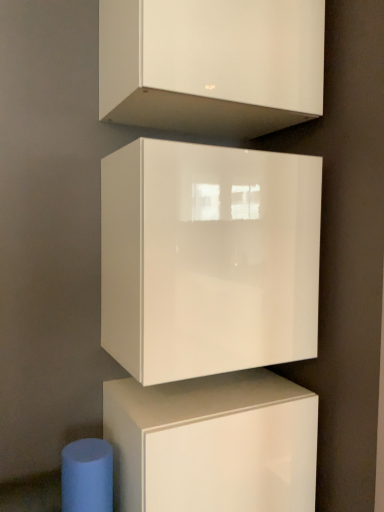
Question: In which direction should I rotate to look at glossy white cabinet at center, which appears as the 3th cabinetry when viewed from the top?

Choices:
 (A) right
 (B) left

Answer: (A)

Question: Is white glossy cabinet at upper center, which appears as the 3th cabinetry when ordered from the bottom, wider than glossy white cube at center, positioned as the 2th cabinetry in bottom-to-top order?

Choices:
 (A) yes
 (B) no

Answer: (B)

Question: Considering the relative positions of white glossy cabinet at upper center, the 1th cabinetry viewed from the top, and glossy white cube at center, positioned as the 2th cabinetry in bottom-to-top order, in the image provided, is white glossy cabinet at upper center, the 1th cabinetry viewed from the top, in front of glossy white cube at center, positioned as the 2th cabinetry in bottom-to-top order,?

Choices:
 (A) yes
 (B) no

Answer: (A)

Question: Can you confirm if white glossy cabinet at upper center, the 1th cabinetry viewed from the top, is thinner than glossy white cube at center, positioned as the 2th cabinetry in bottom-to-top order?

Choices:
 (A) yes
 (B) no

Answer: (A)

Question: Is white glossy cabinet at upper center, which appears as the 3th cabinetry when ordered from the bottom, to the left of glossy white cube at center, which is the second cabinetry in top-to-bottom order, from the viewer's perspective?

Choices:
 (A) yes
 (B) no

Answer: (B)

Question: From the image's perspective, is white glossy cabinet at upper center, which appears as the 3th cabinetry when ordered from the bottom, under glossy white cube at center, positioned as the 2th cabinetry in bottom-to-top order?

Choices:
 (A) no
 (B) yes

Answer: (A)

Question: Considering the relative sizes of white glossy cabinet at upper center, which appears as the 3th cabinetry when ordered from the bottom, and glossy white cube at center, which is the second cabinetry in top-to-bottom order, in the image provided, is white glossy cabinet at upper center, which appears as the 3th cabinetry when ordered from the bottom, taller than glossy white cube at center, which is the second cabinetry in top-to-bottom order,?

Choices:
 (A) yes
 (B) no

Answer: (B)

Question: Would you consider glossy white cabinet at center, which appears as the 3th cabinetry when viewed from the top, to be distant from glossy white cube at center, which is the second cabinetry in top-to-bottom order?

Choices:
 (A) yes
 (B) no

Answer: (B)

Question: Is glossy white cabinet at center, which appears as the 3th cabinetry when viewed from the top, to the right of glossy white cube at center, positioned as the 2th cabinetry in bottom-to-top order, from the viewer's perspective?

Choices:
 (A) yes
 (B) no

Answer: (B)

Question: From a real-world perspective, is glossy white cabinet at center, which appears as the 3th cabinetry when viewed from the top, under glossy white cube at center, which is the second cabinetry in top-to-bottom order?

Choices:
 (A) yes
 (B) no

Answer: (A)

Question: Does glossy white cabinet at center, acting as the 1th cabinetry starting from the bottom, have a greater width compared to glossy white cube at center, which is the second cabinetry in top-to-bottom order?

Choices:
 (A) yes
 (B) no

Answer: (A)

Question: Can you see glossy white cabinet at center, which appears as the 3th cabinetry when viewed from the top, touching glossy white cube at center, positioned as the 2th cabinetry in bottom-to-top order?

Choices:
 (A) yes
 (B) no

Answer: (B)

Question: Considering the relative sizes of glossy white cabinet at center, which appears as the 3th cabinetry when viewed from the top, and glossy white cube at center, which is the second cabinetry in top-to-bottom order, in the image provided, is glossy white cabinet at center, which appears as the 3th cabinetry when viewed from the top, shorter than glossy white cube at center, which is the second cabinetry in top-to-bottom order,?

Choices:
 (A) no
 (B) yes

Answer: (B)

Question: Considering the relative sizes of white glossy cabinet at upper center, the 1th cabinetry viewed from the top, and glossy white cabinet at center, which appears as the 3th cabinetry when viewed from the top, in the image provided, is white glossy cabinet at upper center, the 1th cabinetry viewed from the top, bigger than glossy white cabinet at center, which appears as the 3th cabinetry when viewed from the top,?

Choices:
 (A) yes
 (B) no

Answer: (B)